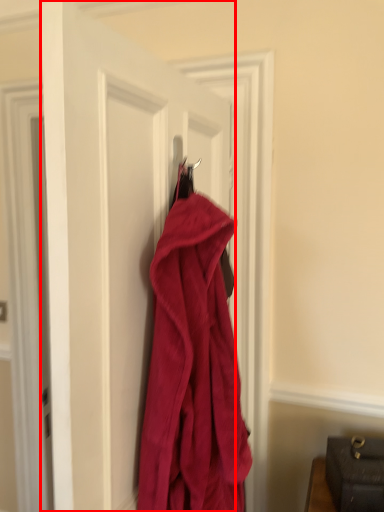
Question: From the image's perspective, what is the correct spatial relationship of door (annotated by the red box) in relation to towel?

Choices:
 (A) above
 (B) below

Answer: (A)